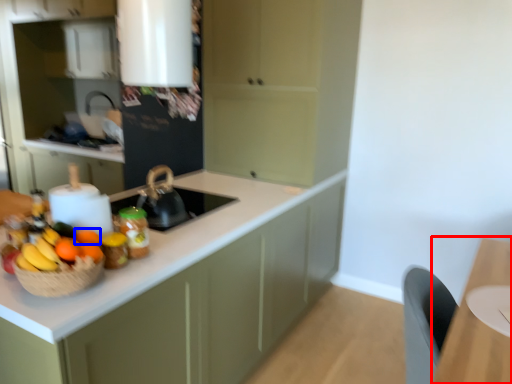
Question: Which object is closer to the camera taking this photo, table (highlighted by a red box) or orange (highlighted by a blue box)?

Choices:
 (A) table
 (B) orange

Answer: (A)